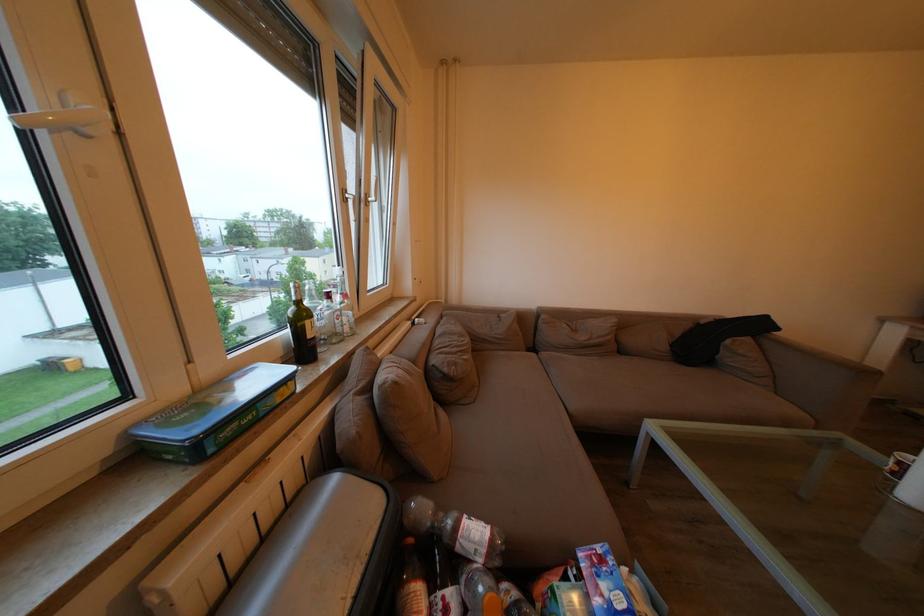
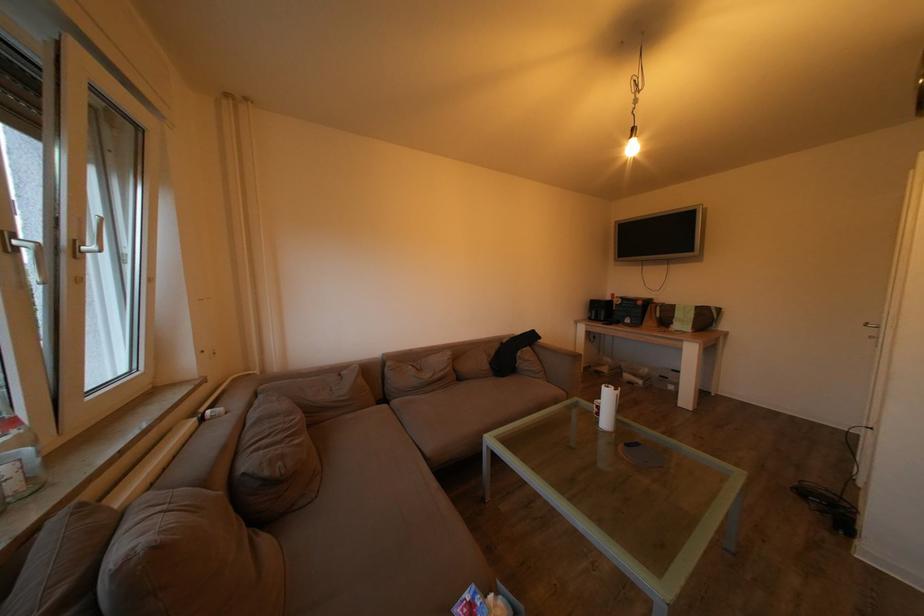
Question: The camera is either moving clockwise (left) or counter-clockwise (right) around the object. The first image is from the beginning of the video and the second image is from the end. Is the camera moving left or right when shooting the video?

Choices:
 (A) Left
 (B) Right

Answer: (A)